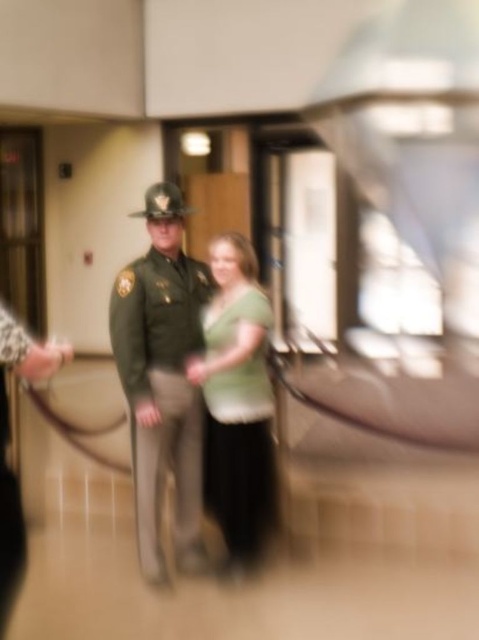
Question: Can you confirm if green uniform at center is positioned below green matte uniform at left?

Choices:
 (A) yes
 (B) no

Answer: (B)

Question: Based on their relative distances, which object is farther from the green matte shirt at center?

Choices:
 (A) green uniform at center
 (B) green matte uniform at left

Answer: (B)

Question: Which object is closer to the camera taking this photo?

Choices:
 (A) green matte uniform at left
 (B) green matte shirt at center
 (C) green uniform at center

Answer: (A)

Question: Can you confirm if green uniform at center is bigger than green matte shirt at center?

Choices:
 (A) yes
 (B) no

Answer: (A)

Question: Which object is positioned closest to the green uniform at center?

Choices:
 (A) green matte shirt at center
 (B) green matte uniform at left

Answer: (A)

Question: Considering the relative positions of green uniform at center and green matte shirt at center in the image provided, where is green uniform at center located with respect to green matte shirt at center?

Choices:
 (A) right
 (B) left

Answer: (B)